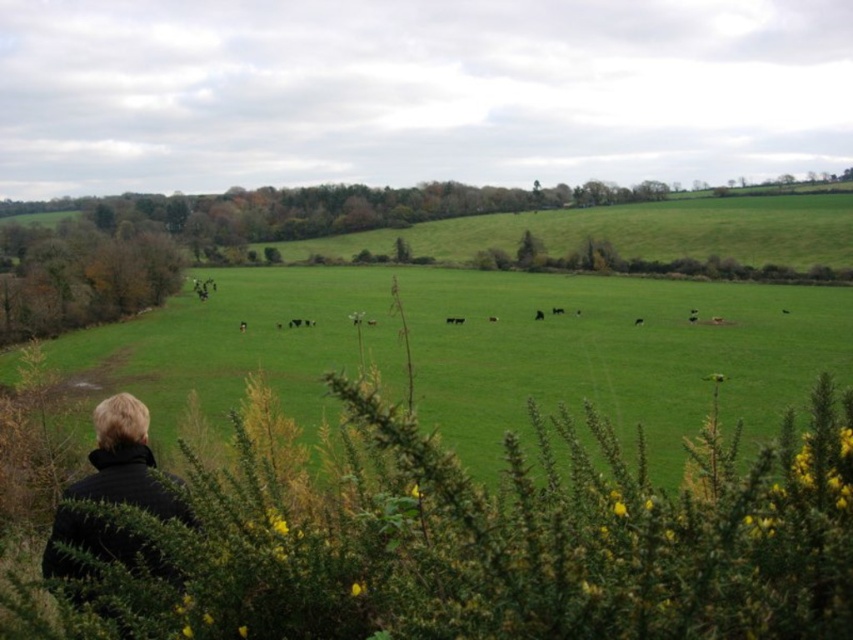
The height and width of the screenshot is (640, 853). What do you see at coordinates (614, 355) in the screenshot?
I see `green grass pasture at center` at bounding box center [614, 355].

Does point (183, 317) lie behind point (107, 456)?

Yes, it is.

Is point (708, 296) farther from viewer compared to point (119, 420)?

That is True.

Identify the location of green grass pasture at center. This screenshot has width=853, height=640. (614, 355).